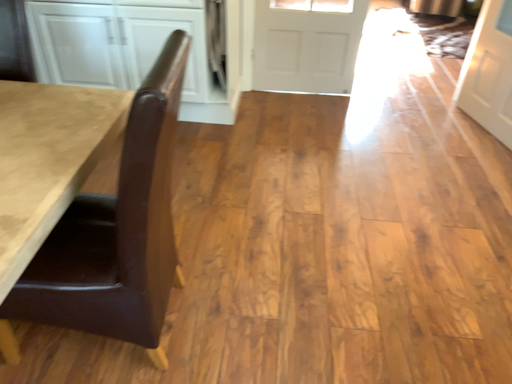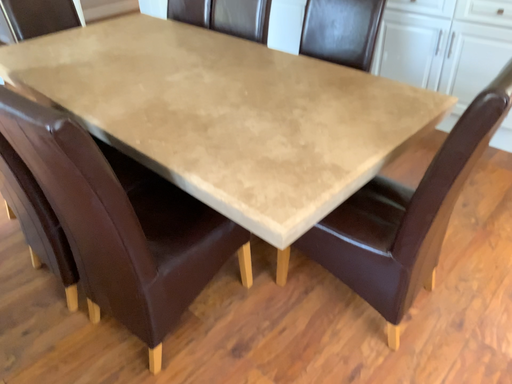
Question: Which way did the camera rotate in the video?

Choices:
 (A) rotated left
 (B) rotated right

Answer: (A)